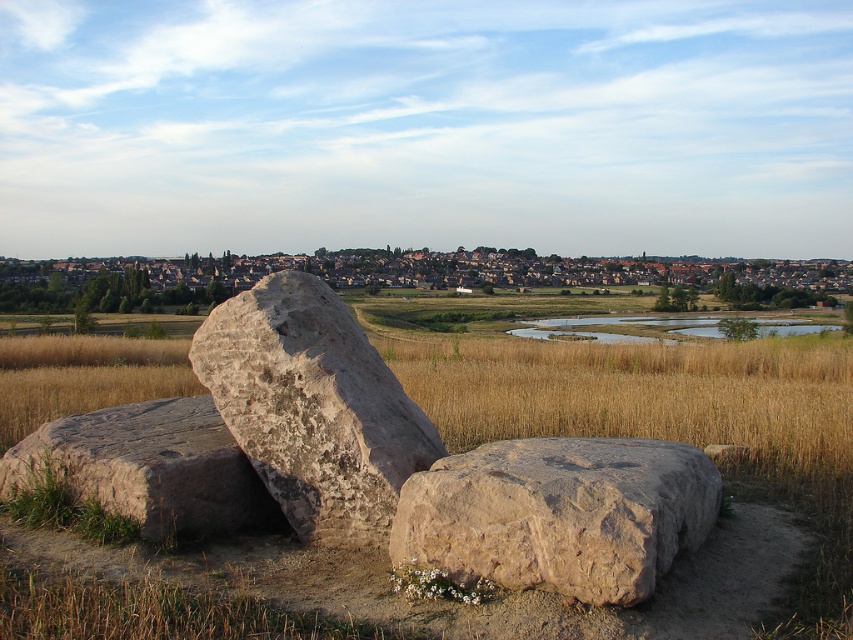
Who is taller, brown rough boulder at center or brown rough rock at center?

Standing taller between the two is brown rough rock at center.

Does brown rough boulder at center appear on the left side of brown rough rock at center?

Incorrect, brown rough boulder at center is not on the left side of brown rough rock at center.

Where is `brown rough boulder at center`? brown rough boulder at center is located at coordinates (560, 513).

This screenshot has height=640, width=853. In order to click on brown rough boulder at center in this screenshot , I will do `click(560, 513)`.

Can you confirm if brown grass at center is positioned to the left of brown rough boulder at center?

Correct, you'll find brown grass at center to the left of brown rough boulder at center.

Who is positioned more to the left, brown grass at center or brown rough boulder at center?

Positioned to the left is brown grass at center.

Does point (49, 394) come farther from viewer compared to point (595, 440)?

Yes, it is behind point (595, 440).

At what (x,y) coordinates should I click in order to perform the action: click on brown grass at center. Please return your answer as a coordinate pair (x, y). Looking at the image, I should click on (670, 419).

The image size is (853, 640). What do you see at coordinates (670, 419) in the screenshot? I see `brown grass at center` at bounding box center [670, 419].

Is point (3, 385) closer to camera compared to point (196, 340)?

That is False.

Image resolution: width=853 pixels, height=640 pixels. What are the coordinates of `brown grass at center` in the screenshot? It's located at coord(670,419).